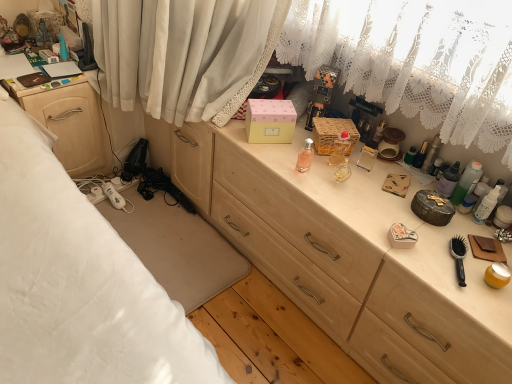
This screenshot has width=512, height=384. Identify the location of free location in front of translucent plastic bottles at right, which ranks as the third toiletry in left-to-right order. (449, 223).